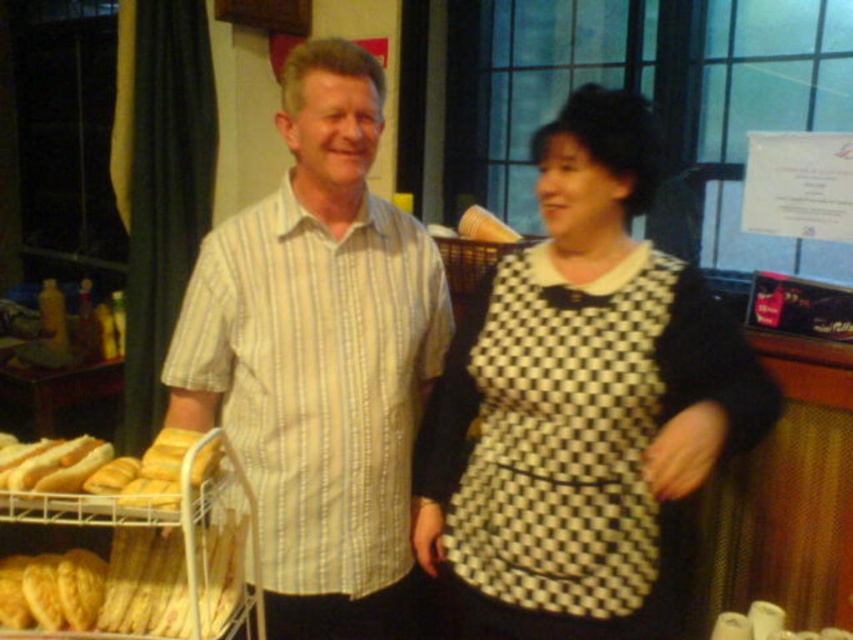
Is point (544, 372) more distant than point (474, 577)?

That is False.

Does black checkered dress at center lie in front of black and white checkered apron at center?

That is True.

Where is `black checkered dress at center`? This screenshot has height=640, width=853. black checkered dress at center is located at coordinates (582, 403).

Does point (618, 538) come behind point (281, 237)?

That is False.

Does black checkered dress at center appear on the right side of yellow striped shirt at center?

Indeed, black checkered dress at center is positioned on the right side of yellow striped shirt at center.

Is point (640, 506) closer to camera compared to point (433, 376)?

Yes, point (640, 506) is closer to viewer.

This screenshot has width=853, height=640. Find the location of `black checkered dress at center`. black checkered dress at center is located at coordinates (582, 403).

In order to click on black and white checkered apron at center in this screenshot , I will do `click(561, 436)`.

Can you confirm if black and white checkered apron at center is wider than metallic silver cart at lower left?

No, black and white checkered apron at center is not wider than metallic silver cart at lower left.

The width and height of the screenshot is (853, 640). Describe the element at coordinates (561, 436) in the screenshot. I see `black and white checkered apron at center` at that location.

Where is `black and white checkered apron at center`? black and white checkered apron at center is located at coordinates (561, 436).